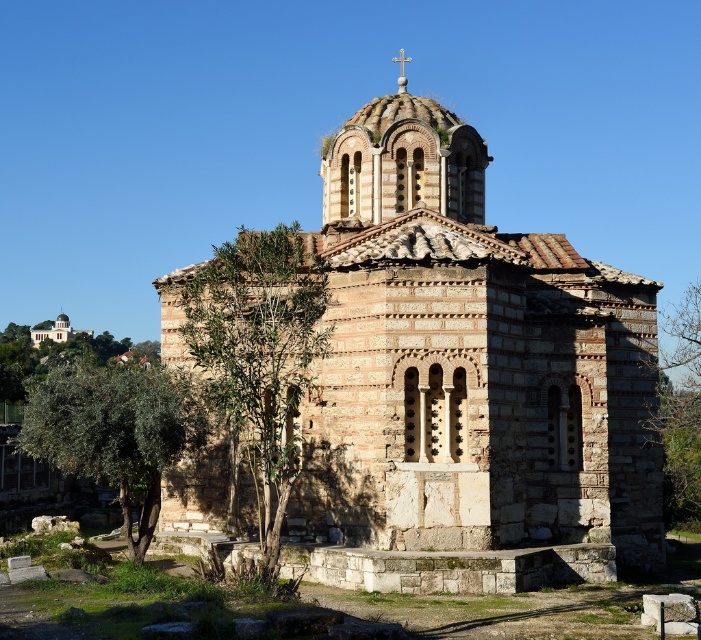
Question: Among these objects, which one is nearest to the camera?

Choices:
 (A) green leafy tree at right
 (B) stone chapel at center
 (C) green leafy tree at center

Answer: (C)

Question: Which object appears farthest from the camera in this image?

Choices:
 (A) green leafy tree at center
 (B) green leafy tree at lower left

Answer: (B)

Question: Which point is farther to the camera?

Choices:
 (A) click(200, 349)
 (B) click(168, 413)
 (C) click(632, 492)

Answer: (C)

Question: Can you confirm if stone chapel at center is smaller than green leafy tree at right?

Choices:
 (A) yes
 (B) no

Answer: (B)

Question: Can you confirm if green leafy tree at center is smaller than green leafy tree at right?

Choices:
 (A) no
 (B) yes

Answer: (B)

Question: Is stone chapel at center closer to camera compared to green leafy tree at lower left?

Choices:
 (A) yes
 (B) no

Answer: (A)